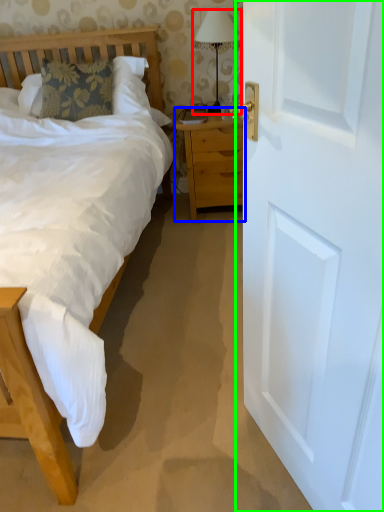
Question: Estimate the real-world distances between objects in this image. Which object is closer to bedside lamp (highlighted by a red box), nightstand (highlighted by a blue box) or door (highlighted by a green box)?

Choices:
 (A) nightstand
 (B) door

Answer: (A)